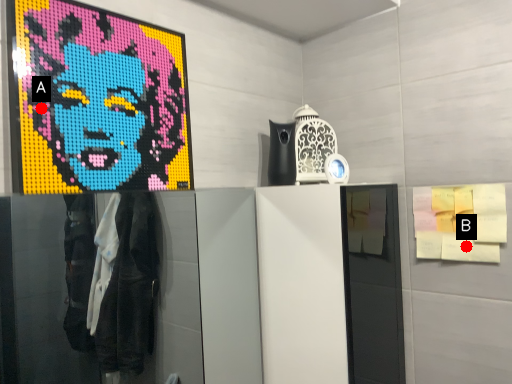
Question: Two points are circled on the image, labeled by A and B beside each circle. Which point is farther from the camera taking this photo?

Choices:
 (A) A is further
 (B) B is further

Answer: (B)